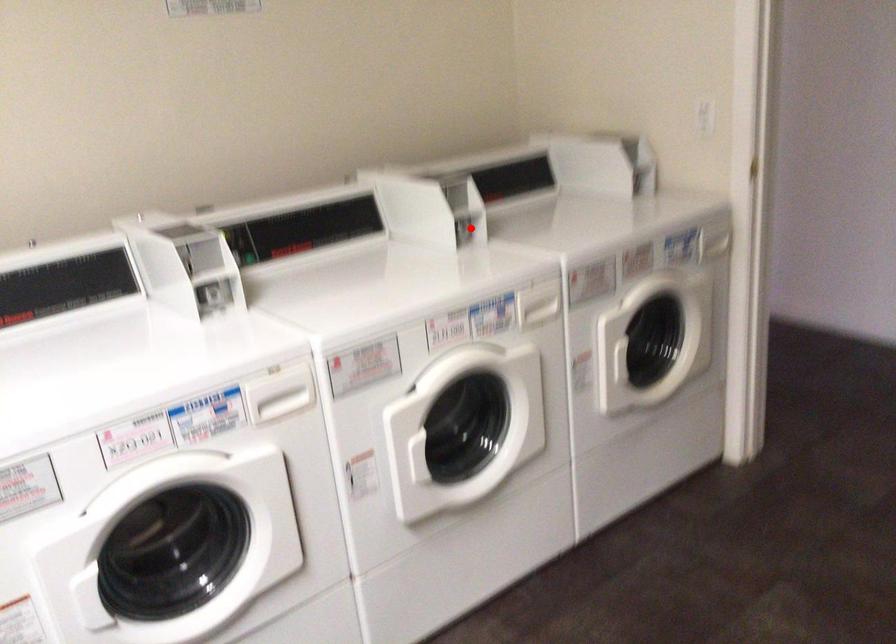
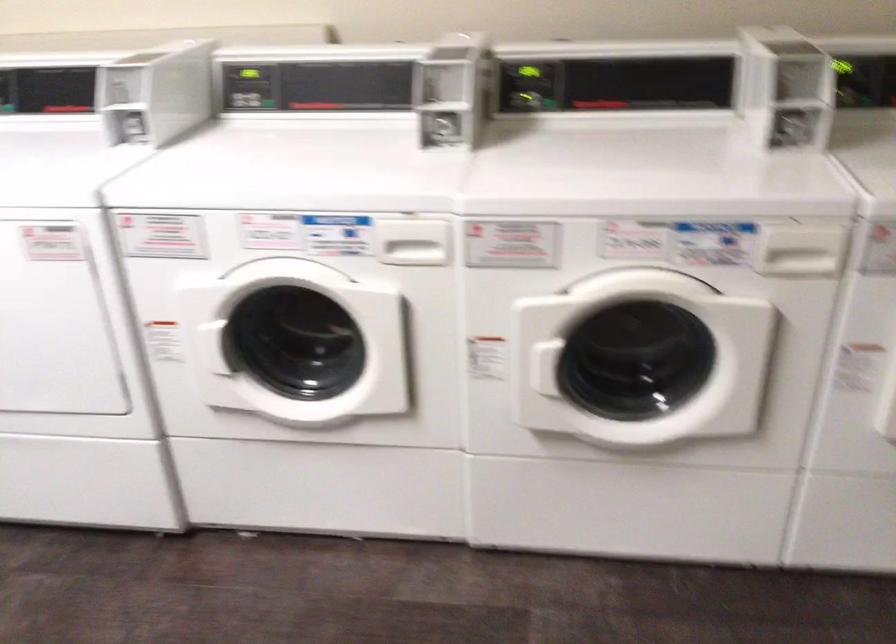
In the second image, find the point that corresponds to the highlighted location in the first image.

(798, 129)